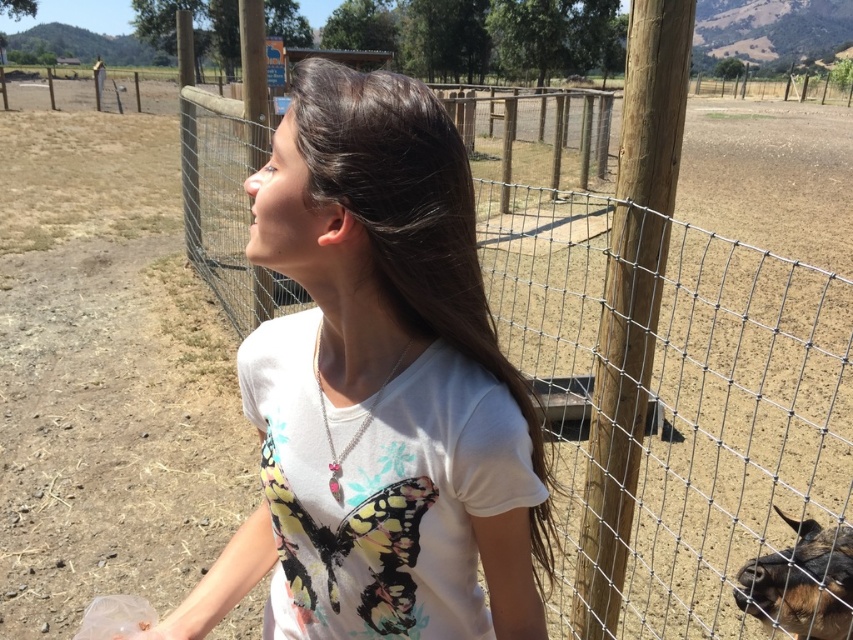
Question: Which object is farther from the camera taking this photo?

Choices:
 (A) brown furry goat at lower right
 (B) white matte shirt at center

Answer: (A)

Question: In this image, where is white matte shirt at center located relative to brown furry goat at lower right?

Choices:
 (A) right
 (B) left

Answer: (B)

Question: Does white matte shirt at center have a lesser width compared to brown furry goat at lower right?

Choices:
 (A) no
 (B) yes

Answer: (A)

Question: Is white matte shirt at center wider than brown furry goat at lower right?

Choices:
 (A) no
 (B) yes

Answer: (B)

Question: Among these points, which one is farthest from the camera?

Choices:
 (A) 413,305
 (B) 744,566

Answer: (B)

Question: Which point appears closest to the camera in this image?

Choices:
 (A) (444, 252)
 (B) (828, 608)

Answer: (A)